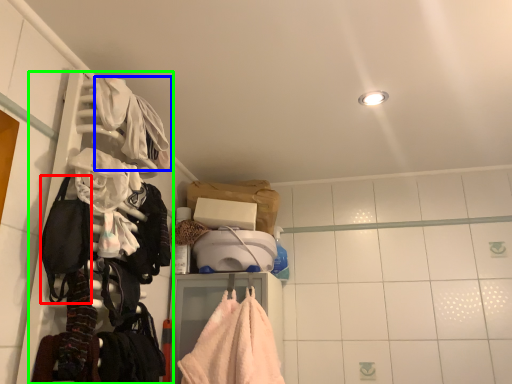
Question: Which object is the farthest from gear (highlighted by a red box)? Choose among these: clothing (highlighted by a blue box) or closet (highlighted by a green box).

Choices:
 (A) clothing
 (B) closet

Answer: (A)